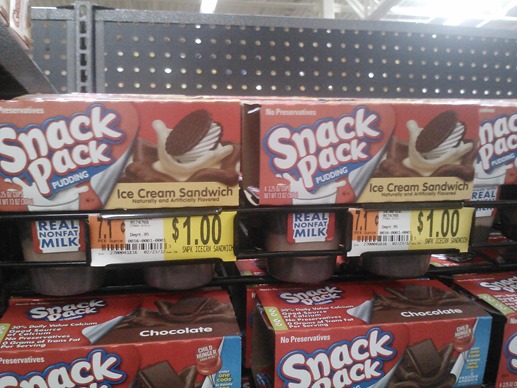
Locate an element on the screen. This screenshot has width=517, height=388. back of shelf is located at coordinates (268, 65).